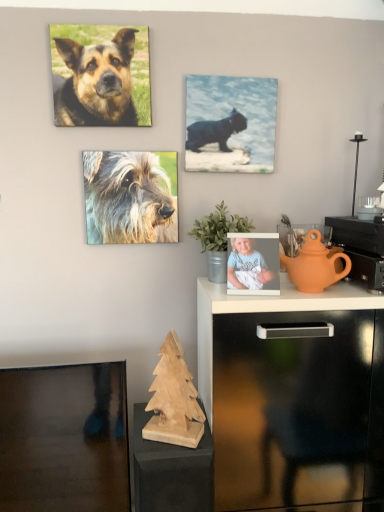
Question: From a real-world perspective, is black glossy cat at upper center positioned over light blue fabric baby at upper center based on gravity?

Choices:
 (A) no
 (B) yes

Answer: (B)

Question: From the image's perspective, would you say black glossy cat at upper center is shown under light blue fabric baby at upper center?

Choices:
 (A) no
 (B) yes

Answer: (A)

Question: Is the position of black glossy cat at upper center less distant than that of light blue fabric baby at upper center?

Choices:
 (A) no
 (B) yes

Answer: (A)

Question: Is black glossy cat at upper center looking in the opposite direction of light blue fabric baby at upper center?

Choices:
 (A) no
 (B) yes

Answer: (A)

Question: Does black glossy cat at upper center have a greater width compared to light blue fabric baby at upper center?

Choices:
 (A) no
 (B) yes

Answer: (A)

Question: Is black glossy cat at upper center directly adjacent to light blue fabric baby at upper center?

Choices:
 (A) yes
 (B) no

Answer: (B)

Question: Can you confirm if golden fur dog at upper left, which appears as the 2th dog when ordered from the bottom, is wider than black glossy cat at upper center?

Choices:
 (A) no
 (B) yes

Answer: (A)

Question: Is golden fur dog at upper left, which appears as the 2th dog when ordered from the bottom, to the right of black glossy cat at upper center from the viewer's perspective?

Choices:
 (A) yes
 (B) no

Answer: (B)

Question: Is golden fur dog at upper left, which is the first dog from top to bottom, at the left side of black glossy cat at upper center?

Choices:
 (A) no
 (B) yes

Answer: (B)

Question: Is golden fur dog at upper left, which is the first dog from top to bottom, taller than black glossy cat at upper center?

Choices:
 (A) yes
 (B) no

Answer: (B)

Question: Are golden fur dog at upper left, which appears as the 2th dog when ordered from the bottom, and black glossy cat at upper center making contact?

Choices:
 (A) yes
 (B) no

Answer: (B)

Question: Is golden fur dog at upper left, which is the first dog from top to bottom, closer to the viewer compared to black glossy cat at upper center?

Choices:
 (A) no
 (B) yes

Answer: (B)

Question: Is orange clay teapot at right positioned far away from fuzzy fur dog at center, which ranks as the first dog in bottom-to-top order?

Choices:
 (A) yes
 (B) no

Answer: (B)